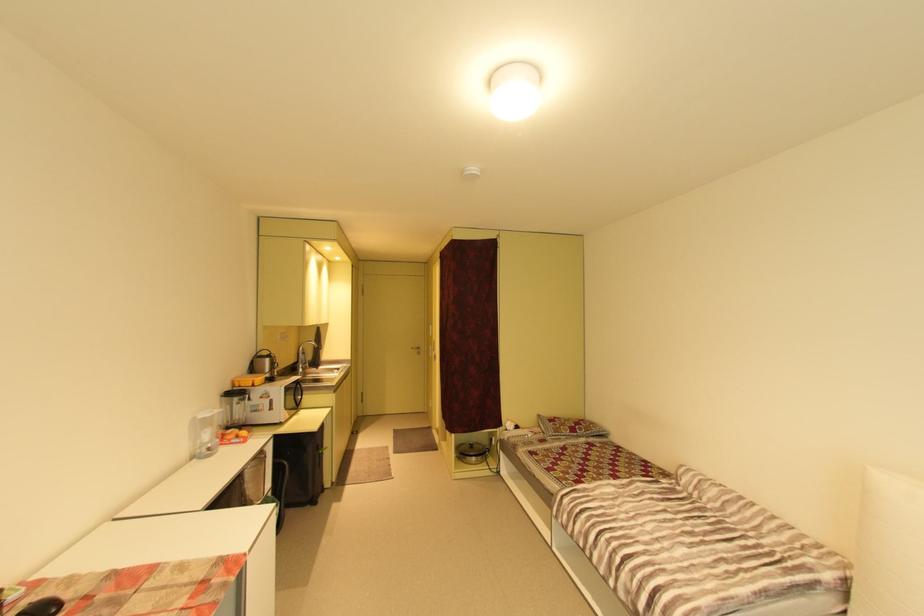
Where would you lift the patterned pillow? Please return your answer as a coordinate pair (x, y).

(569, 427)